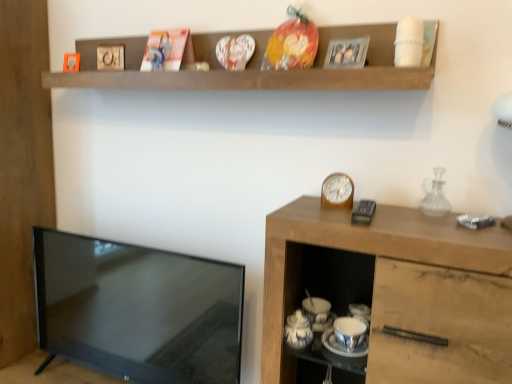
At what (x,y) coordinates should I click in order to perform the action: click on vacant region to the left of transparent glass carafe at right. Please return your answer as a coordinate pair (x, y). This screenshot has height=384, width=512. Looking at the image, I should click on (399, 216).